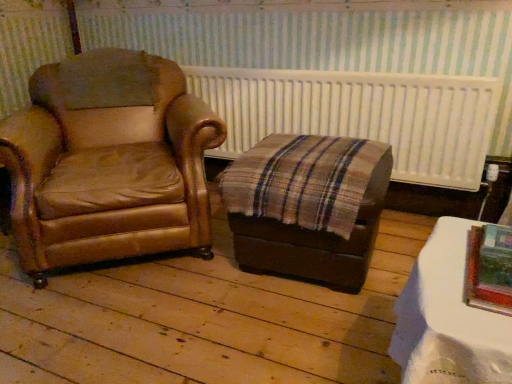
Locate an element on the screen. metallic silver picture frame at lower right is located at coordinates (489, 269).

Measure the distance between metallic silver picture frame at lower right and camera.

metallic silver picture frame at lower right is 29.33 inches away from camera.

Describe the element at coordinates (361, 115) in the screenshot. I see `white textured radiator at upper center` at that location.

Where is `metallic silver picture frame at lower right`? This screenshot has width=512, height=384. metallic silver picture frame at lower right is located at coordinates (489, 269).

Would you say brown leather chair at left is outside metallic silver picture frame at lower right?

That's correct, brown leather chair at left is outside of metallic silver picture frame at lower right.

Considering the relative positions of brown leather chair at left and metallic silver picture frame at lower right in the image provided, is brown leather chair at left to the left of metallic silver picture frame at lower right from the viewer's perspective?

Indeed, brown leather chair at left is positioned on the left side of metallic silver picture frame at lower right.

Which is behind, point (51, 192) or point (494, 267)?

The point (51, 192) is more distant.

Could you tell me if brown leather chair at left is facing metallic silver picture frame at lower right?

No, brown leather chair at left is not oriented towards metallic silver picture frame at lower right.

Find the location of a particular element. This screenshot has height=384, width=512. radiator to the right of brown leather chair at left is located at coordinates (361, 115).

Consider the image. Which object is positioned more to the left, white textured radiator at upper center or brown leather chair at left?

From the viewer's perspective, brown leather chair at left appears more on the left side.

Is white textured radiator at upper center further to the viewer compared to brown leather chair at left?

Yes, the depth of white textured radiator at upper center is greater than that of brown leather chair at left.

Who is taller, white textured radiator at upper center or brown leather chair at left?

brown leather chair at left.

Is white glossy table at lower right outside of brown leather chair at left?

Yes, white glossy table at lower right is outside of brown leather chair at left.

Based on the photo, are white glossy table at lower right and brown leather chair at left beside each other?

white glossy table at lower right and brown leather chair at left are not in contact.

From the image's perspective, between white glossy table at lower right and brown leather chair at left, who is located below?

white glossy table at lower right, from the image's perspective.

From a real-world perspective, between white glossy table at lower right and brown leather chair at left, who is vertically higher?

brown leather chair at left is physically above.

From the image's perspective, which one is positioned lower, white glossy table at lower right or metallic silver picture frame at lower right?

white glossy table at lower right is shown below in the image.

Does white glossy table at lower right come behind metallic silver picture frame at lower right?

No, white glossy table at lower right is closer to the viewer.

Is white glossy table at lower right outside of metallic silver picture frame at lower right?

white glossy table at lower right is positioned outside metallic silver picture frame at lower right.

Is the position of metallic silver picture frame at lower right more distant than that of white textured radiator at upper center?

No, the depth of metallic silver picture frame at lower right is less than that of white textured radiator at upper center.

The width and height of the screenshot is (512, 384). Find the location of `radiator below the metallic silver picture frame at lower right (from a real-world perspective)`. radiator below the metallic silver picture frame at lower right (from a real-world perspective) is located at coordinates 361,115.

How much distance is there between metallic silver picture frame at lower right and white textured radiator at upper center?

1.32 meters.

Does white glossy table at lower right turn towards white textured radiator at upper center?

No, white glossy table at lower right is not turned towards white textured radiator at upper center.

Does point (426, 378) come closer to viewer compared to point (474, 177)?

That is True.

Is the depth of white glossy table at lower right greater than that of white textured radiator at upper center?

No.

Locate an element on the screen. This screenshot has width=512, height=384. picture frame above the white glossy table at lower right (from the image's perspective) is located at coordinates (489, 269).

Would you say metallic silver picture frame at lower right is inside or outside white glossy table at lower right?

metallic silver picture frame at lower right exists outside the volume of white glossy table at lower right.

How much distance is there between metallic silver picture frame at lower right and white glossy table at lower right?

metallic silver picture frame at lower right and white glossy table at lower right are 3.52 inches apart from each other.

Find the location of a particular element. The height and width of the screenshot is (384, 512). picture frame lying below the brown leather chair at left (from the image's perspective) is located at coordinates (489, 269).

Identify the location of chair beneath the white textured radiator at upper center (from a real-world perspective). (108, 162).

From the image, which object appears to be farther from metallic silver picture frame at lower right, white glossy table at lower right or brown leather chair at left?

brown leather chair at left is positioned further to the anchor metallic silver picture frame at lower right.

From the image, which object appears to be nearer to brown leather chair at left, white textured radiator at upper center or metallic silver picture frame at lower right?

The object closer to brown leather chair at left is white textured radiator at upper center.

Considering their positions, is white textured radiator at upper center positioned further to white glossy table at lower right than brown leather chair at left?

white textured radiator at upper center is positioned further to the anchor white glossy table at lower right.

When comparing their distances from white textured radiator at upper center, does white glossy table at lower right or brown leather chair at left seem further?

white glossy table at lower right is further to white textured radiator at upper center.

From the image, which object appears to be farther from white glossy table at lower right, brown leather chair at left or white textured radiator at upper center?

white textured radiator at upper center is positioned further to the anchor white glossy table at lower right.

From the picture: From the image, which object appears to be farther from white textured radiator at upper center, brown leather chair at left or white glossy table at lower right?

Based on the image, white glossy table at lower right appears to be further to white textured radiator at upper center.

Looking at the image, which one is located closer to brown leather chair at left, white textured radiator at upper center or white glossy table at lower right?

white textured radiator at upper center is closer to brown leather chair at left.

Based on their spatial positions, is white textured radiator at upper center or white glossy table at lower right closer to metallic silver picture frame at lower right?

white glossy table at lower right is closer to metallic silver picture frame at lower right.

The width and height of the screenshot is (512, 384). What are the coordinates of `table between brown leather chair at left and metallic silver picture frame at lower right in the horizontal direction` in the screenshot? It's located at (448, 319).

The width and height of the screenshot is (512, 384). What are the coordinates of `radiator between brown leather chair at left and white glossy table at lower right from left to right` in the screenshot? It's located at (361, 115).

Locate an element on the screen. picture frame between white glossy table at lower right and white textured radiator at upper center in the front-back direction is located at coordinates (489, 269).

Find the location of a particular element. The width and height of the screenshot is (512, 384). radiator situated between brown leather chair at left and metallic silver picture frame at lower right from left to right is located at coordinates (361, 115).